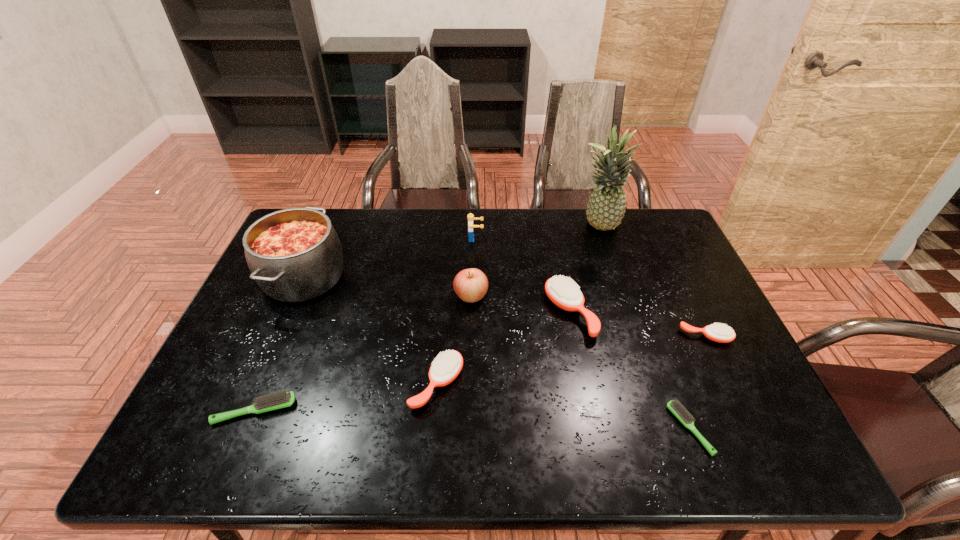
Locate an element on the screen. free space between the fifth tallest object and the pineapple is located at coordinates (584, 270).

At what (x,y) coordinates should I click in order to perform the action: click on unoccupied area between the fourth object from right to left and the rightmost object. Please return your answer as a coordinate pair (x, y). The width and height of the screenshot is (960, 540). Looking at the image, I should click on (637, 325).

Locate an element on the screen. This screenshot has width=960, height=540. vacant space that is in between the sixth tallest object and the Lego is located at coordinates (456, 311).

Find the location of a particular element. This screenshot has width=960, height=540. blank region between the casserole and the shortest object is located at coordinates (496, 353).

Locate an element on the screen. This screenshot has height=540, width=960. free space between the third hairbrush from right to left and the casserole is located at coordinates 437,295.

Where is `free space that is in between the casserole and the bigger light hairbrush`? free space that is in between the casserole and the bigger light hairbrush is located at coordinates (279, 344).

The image size is (960, 540). I want to click on object that ranks as the third closest to the rightmost object, so click(x=606, y=207).

Find the location of a particular element. the fourth closest object relative to the Lego is located at coordinates (294, 254).

Where is `the third closest hairbrush to the nearest orange hairbrush`? Image resolution: width=960 pixels, height=540 pixels. the third closest hairbrush to the nearest orange hairbrush is located at coordinates (683, 415).

Identify which hairbrush is the third nearest to the second hairbrush from right to left. Please provide its 2D coordinates. Your answer should be formatted as a tuple, i.e. [(x, y)], where the tuple contains the x and y coordinates of a point satisfying the conditions above.

[(446, 367)]